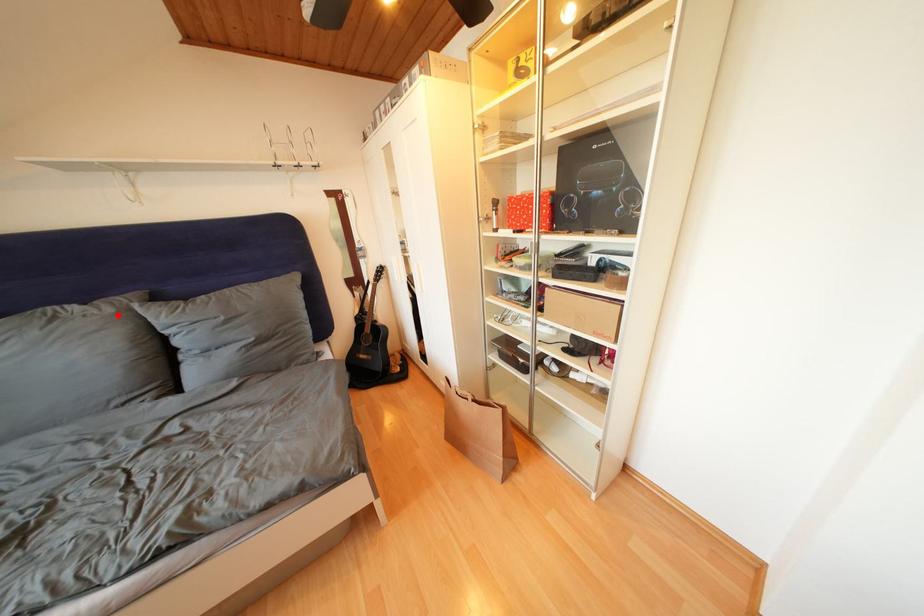
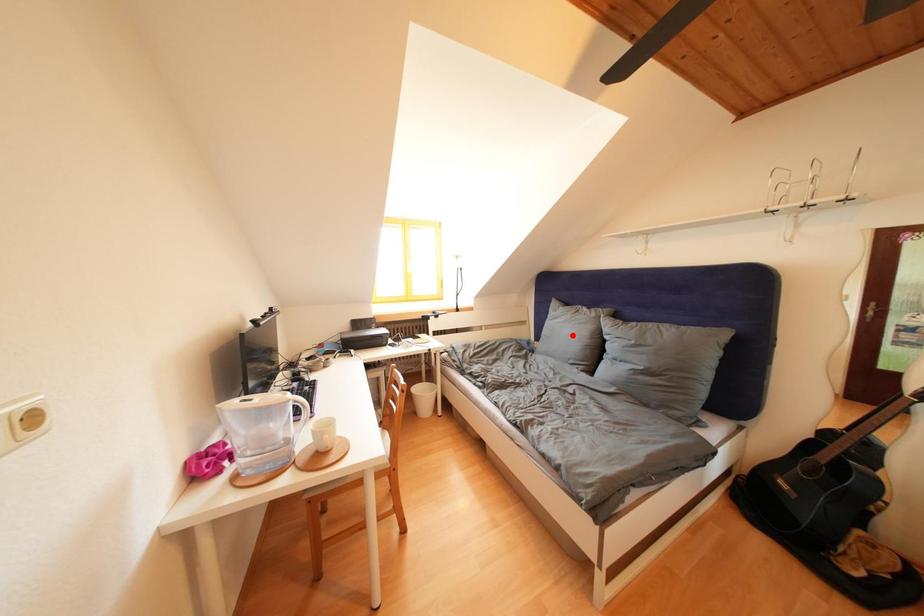
From the picture: I am providing you with two images of the same scene from different viewpoints. A red point is marked on the first image and another point is marked on the second image. Are the points marked in image1 and image2 representing the same 3D position?

No